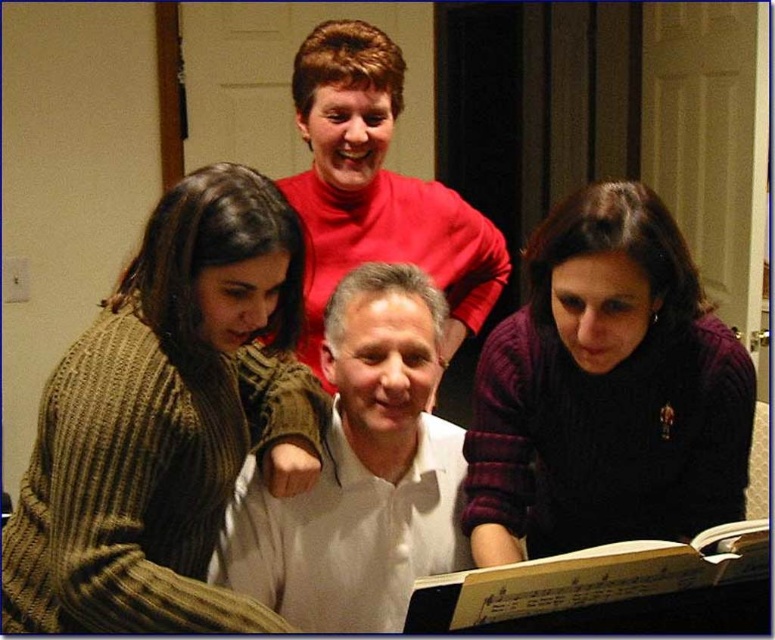
Question: Which object appears closest to the camera in this image?

Choices:
 (A) dark purple sweater at lower right
 (B) white matte shirt at center
 (C) green knitted sweater at left
 (D) yellow paper music book at lower center

Answer: (D)

Question: Does dark purple sweater at lower right appear under yellow paper music book at lower center?

Choices:
 (A) no
 (B) yes

Answer: (A)

Question: Can you confirm if dark purple sweater at lower right is wider than white matte shirt at center?

Choices:
 (A) no
 (B) yes

Answer: (B)

Question: Which object is the closest to the green knitted sweater at left?

Choices:
 (A) white matte shirt at center
 (B) yellow paper music book at lower center

Answer: (A)

Question: Is green knitted sweater at left positioned before white matte shirt at center?

Choices:
 (A) yes
 (B) no

Answer: (A)

Question: Which point is closer to the camera taking this photo?

Choices:
 (A) (691, 282)
 (B) (415, 529)
 (C) (312, 342)

Answer: (A)